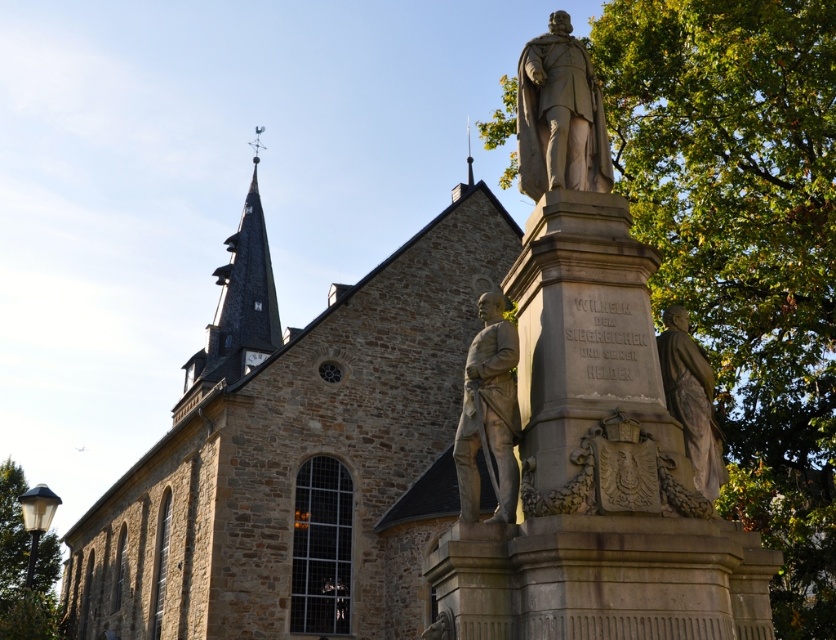
Question: Which object is farther from the camera taking this photo?

Choices:
 (A) matte bronze statue at center
 (B) brown stone church at center

Answer: (A)

Question: Is dark gray stone clock tower at upper left to the right of matte bronze statue at center from the viewer's perspective?

Choices:
 (A) no
 (B) yes

Answer: (A)

Question: Is dark gray stone clock tower at upper left closer to camera compared to stone statue at center?

Choices:
 (A) no
 (B) yes

Answer: (A)

Question: Based on their relative distances, which object is farther from the stone statue at upper right?

Choices:
 (A) stone statue at center
 (B) green leafy tree at lower left

Answer: (B)

Question: Which object is the closest to the matte bronze statue at center?

Choices:
 (A) brown stone church at center
 (B) dark gray stone clock tower at upper left

Answer: (A)

Question: Can you confirm if green leafy tree at right is smaller than dark gray stone clock tower at upper left?

Choices:
 (A) yes
 (B) no

Answer: (A)